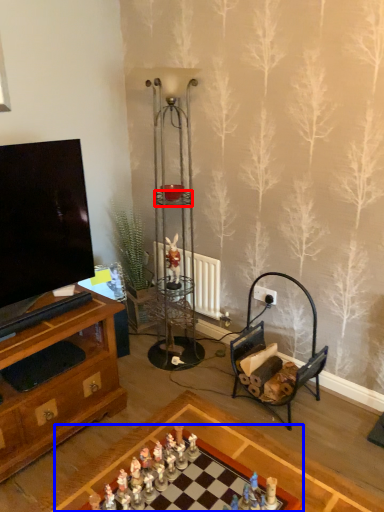
Question: Which object is further to the camera taking this photo, shelf (highlighted by a red box) or table (highlighted by a blue box)?

Choices:
 (A) shelf
 (B) table

Answer: (A)